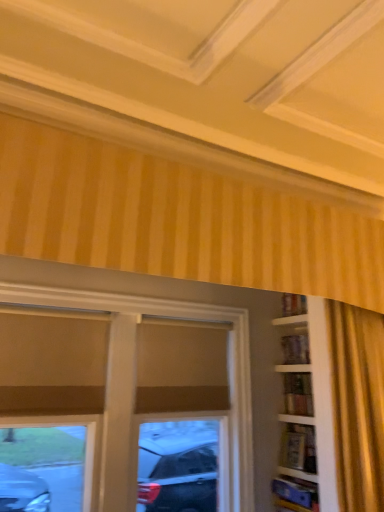
Question: Is wooden bookshelf at right, which appears as the 2th shelf when ordered from the bottom, further to the viewer compared to wooden bookshelf at right, which appears as the 2th shelf when viewed from the top?

Choices:
 (A) no
 (B) yes

Answer: (B)

Question: Is wooden bookshelf at right, which appears as the 2th shelf when viewed from the top, completely or partially inside wooden bookshelf at right, which is counted as the 1th shelf, starting from the top?

Choices:
 (A) no
 (B) yes

Answer: (A)

Question: Is wooden bookshelf at right, which is counted as the 1th shelf, starting from the top, smaller than wooden bookshelf at right, marked as the first shelf in a bottom-to-top arrangement?

Choices:
 (A) no
 (B) yes

Answer: (B)

Question: From the image's perspective, is wooden bookshelf at right, which appears as the 2th shelf when ordered from the bottom, below wooden bookshelf at right, marked as the first shelf in a bottom-to-top arrangement?

Choices:
 (A) yes
 (B) no

Answer: (B)

Question: Does wooden bookshelf at right, which appears as the 2th shelf when ordered from the bottom, touch wooden bookshelf at right, which appears as the 2th shelf when viewed from the top?

Choices:
 (A) yes
 (B) no

Answer: (B)

Question: Is matte brown window at center in front of or behind wooden bookshelf at right, marked as the first shelf in a bottom-to-top arrangement, in the image?

Choices:
 (A) behind
 (B) front

Answer: (B)

Question: Is point pos(249,476) closer or farther from the camera than point pos(296,484)?

Choices:
 (A) farther
 (B) closer

Answer: (A)

Question: Looking at their shapes, would you say matte brown window at center is wider or thinner than wooden bookshelf at right, marked as the first shelf in a bottom-to-top arrangement?

Choices:
 (A) wide
 (B) thin

Answer: (B)

Question: Looking at the image, does matte brown window at center seem bigger or smaller compared to wooden bookshelf at right, marked as the first shelf in a bottom-to-top arrangement?

Choices:
 (A) big
 (B) small

Answer: (A)

Question: Choose the correct answer: Is wooden bookshelf at right, which appears as the 2th shelf when viewed from the top, inside matte brown window at center or outside it?

Choices:
 (A) inside
 (B) outside

Answer: (B)

Question: Is wooden bookshelf at right, marked as the first shelf in a bottom-to-top arrangement, bigger or smaller than matte brown window at center?

Choices:
 (A) small
 (B) big

Answer: (A)

Question: Considering the positions of wooden bookshelf at right, marked as the first shelf in a bottom-to-top arrangement, and matte brown window at center in the image, is wooden bookshelf at right, marked as the first shelf in a bottom-to-top arrangement, taller or shorter than matte brown window at center?

Choices:
 (A) short
 (B) tall

Answer: (A)

Question: Considering the positions of wooden bookshelf at right, which appears as the 2th shelf when viewed from the top, and matte brown window at center in the image, is wooden bookshelf at right, which appears as the 2th shelf when viewed from the top, wider or thinner than matte brown window at center?

Choices:
 (A) wide
 (B) thin

Answer: (A)

Question: From the image's perspective, is wooden bookshelf at right, which is counted as the 1th shelf, starting from the top, located above or below wooden bookshelf at right, marked as the first shelf in a bottom-to-top arrangement?

Choices:
 (A) above
 (B) below

Answer: (A)

Question: Considering the positions of point (288, 408) and point (296, 499), is point (288, 408) closer or farther from the camera than point (296, 499)?

Choices:
 (A) farther
 (B) closer

Answer: (A)